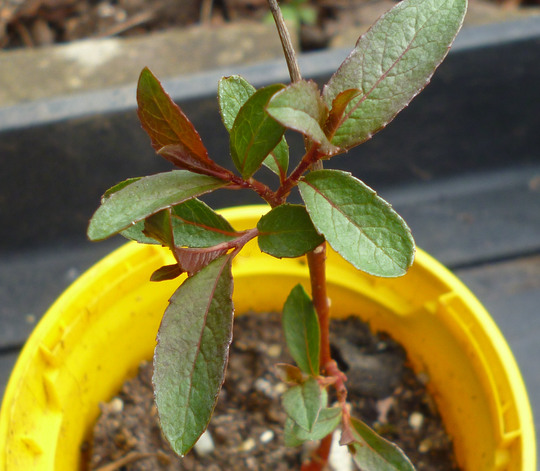
Locate an element on the screen. floor is located at coordinates (498, 281).